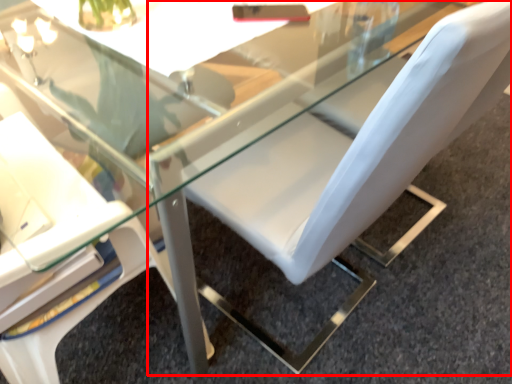
Question: From the image's perspective, considering the relative positions of chair (annotated by the red box) and chair in the image provided, where is chair (annotated by the red box) located with respect to the staircase?

Choices:
 (A) above
 (B) below

Answer: (A)